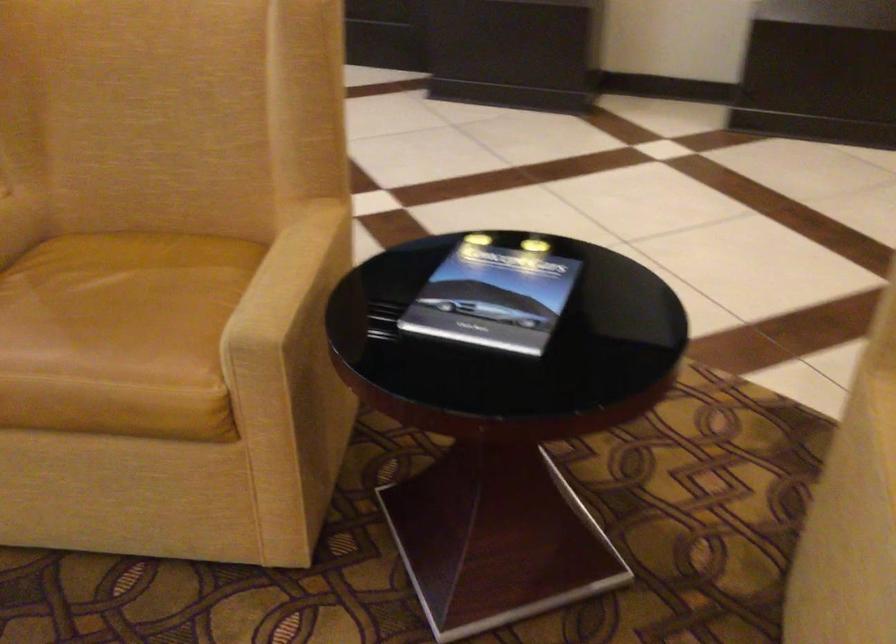
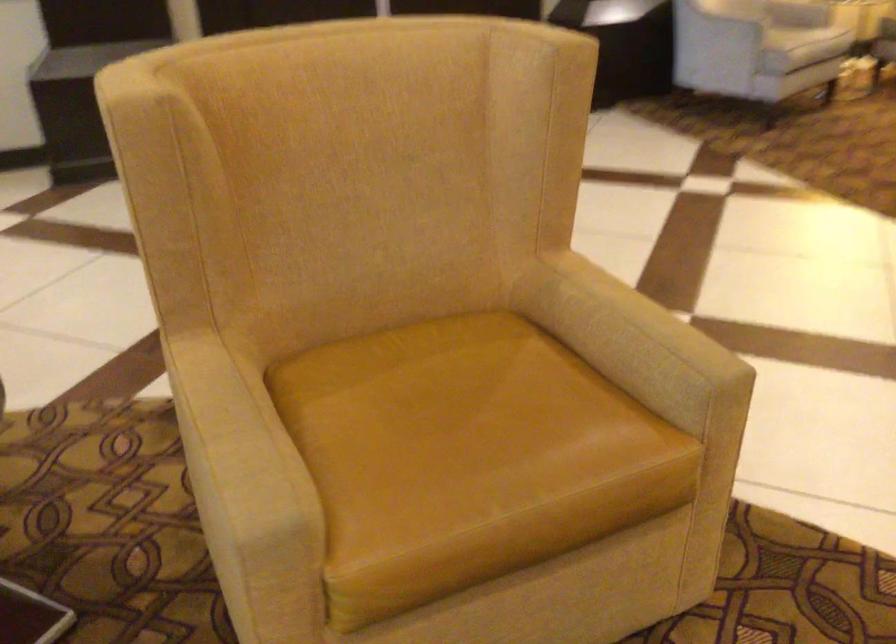
Question: The images are taken continuously from a first-person perspective. In which direction is your viewpoint rotating?

Choices:
 (A) Left
 (B) Right
 (C) Up
 (D) Down

Answer: (B)